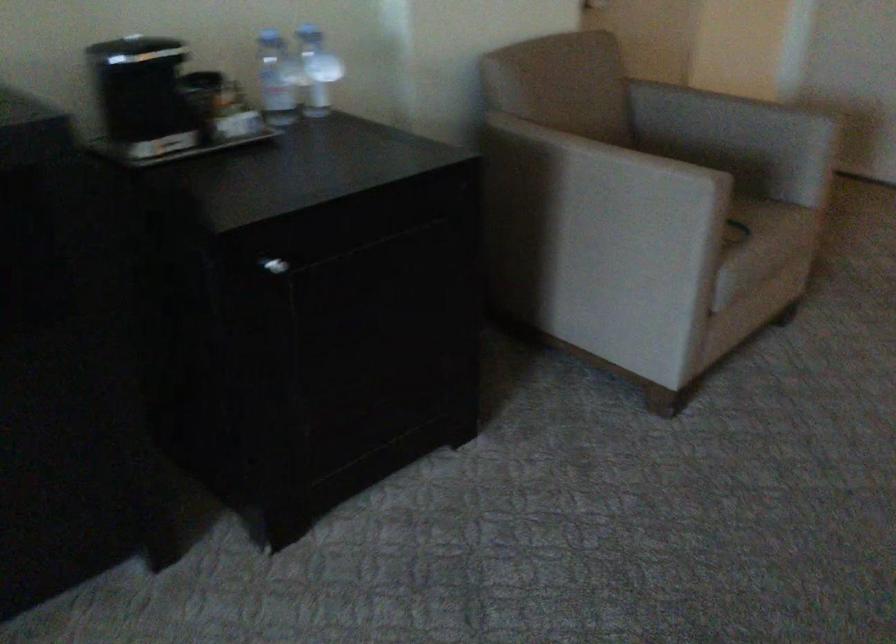
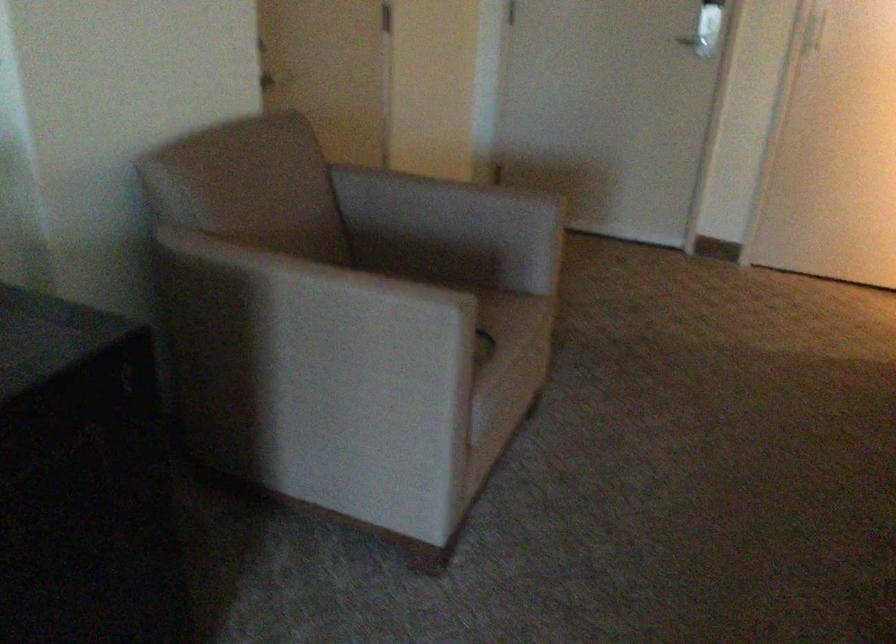
Locate, in the second image, the point that corresponds to pixel 591 190 in the first image.

(314, 325)